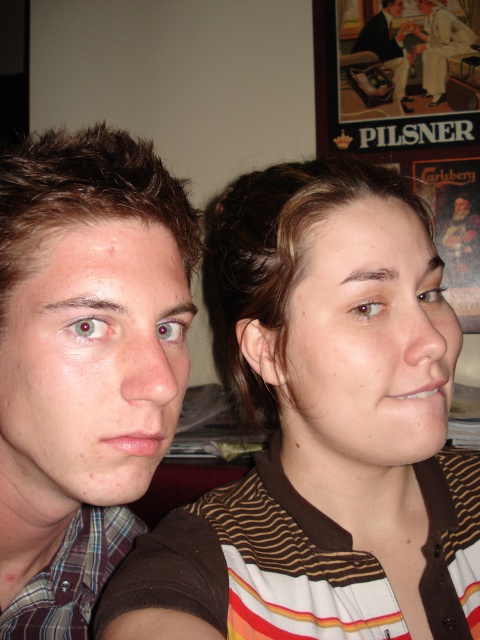
Can you confirm if matte skin face at left is thinner than matte paper poster at upper right?

Indeed, matte skin face at left has a lesser width compared to matte paper poster at upper right.

Where is `matte skin face at left`? matte skin face at left is located at coordinates (92, 365).

How much distance is there between matte brown hair at center and matte black suit at upper center?

The distance of matte brown hair at center from matte black suit at upper center is 6.59 feet.

Between point (435, 442) and point (375, 51), which one is positioned in front?

Point (435, 442) is in front.

Describe the element at coordinates (365, 348) in the screenshot. I see `matte brown hair at center` at that location.

Locate an element on the screen. This screenshot has width=480, height=640. matte brown hair at center is located at coordinates (365, 348).

Based on the photo, between brown striped shirt at center and matte skin face at center, which one is positioned higher?

matte skin face at center is higher up.

Does brown striped shirt at center appear under matte skin face at center?

Yes.

The image size is (480, 640). Identify the location of brown striped shirt at center. (323, 429).